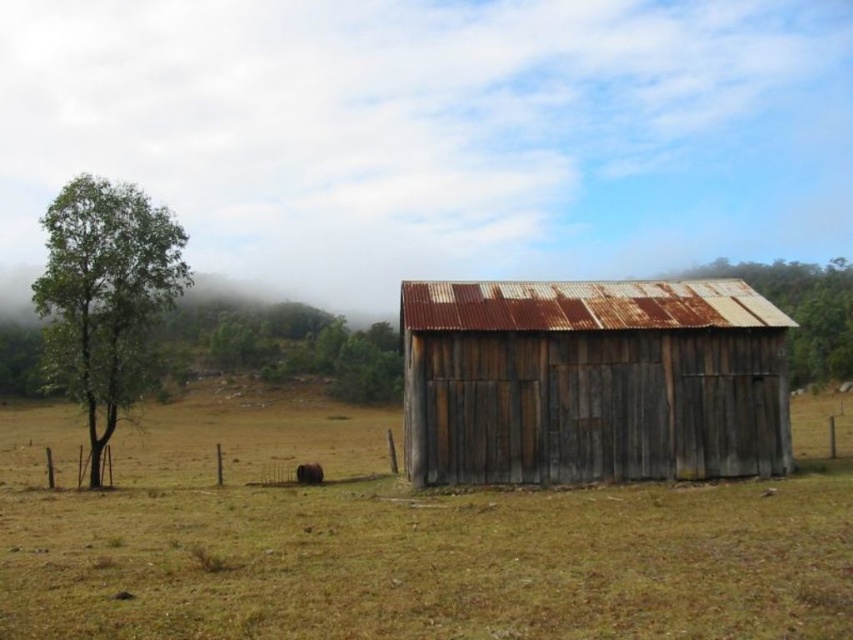
Question: Which object is positioned farthest from the green leafy tree at left?

Choices:
 (A) green leafy tree at upper center
 (B) brown fur dog at lower center
 (C) rusty wood shed at center
 (D) dry grass at center

Answer: (A)

Question: Among these objects, which one is farthest from the camera?

Choices:
 (A) brown fur dog at lower center
 (B) green leafy tree at left
 (C) rusty wood shed at center
 (D) green leafy tree at upper center

Answer: (B)

Question: Which point is closer to the camera taking this photo?

Choices:
 (A) [x=294, y=592]
 (B) [x=315, y=476]

Answer: (A)

Question: Can you confirm if dry grass at center is positioned to the left of rusty wood shed at center?

Choices:
 (A) yes
 (B) no

Answer: (A)

Question: Does dry grass at center have a lesser width compared to green leafy tree at left?

Choices:
 (A) no
 (B) yes

Answer: (A)

Question: Can you confirm if rusty wood shed at center is positioned to the left of brown fur dog at lower center?

Choices:
 (A) no
 (B) yes

Answer: (A)